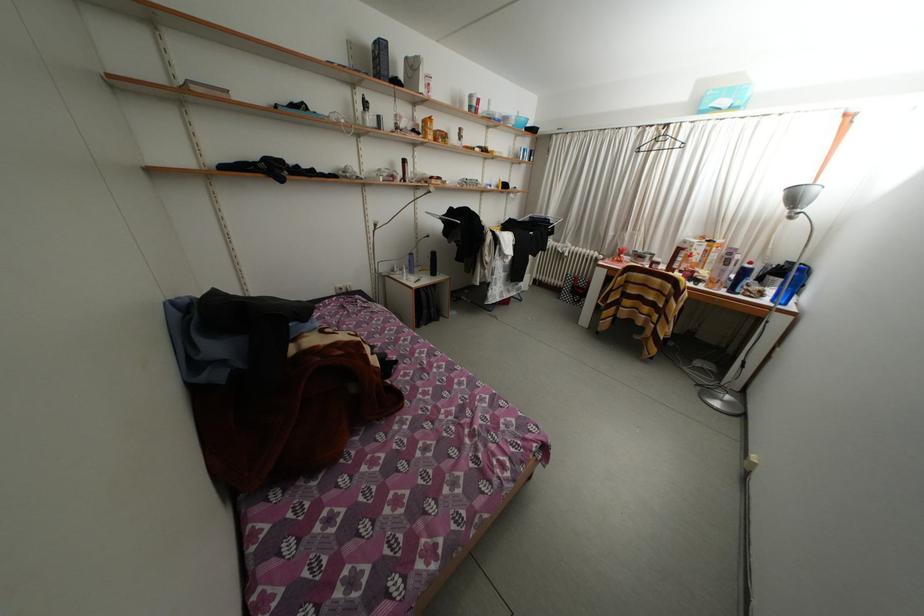
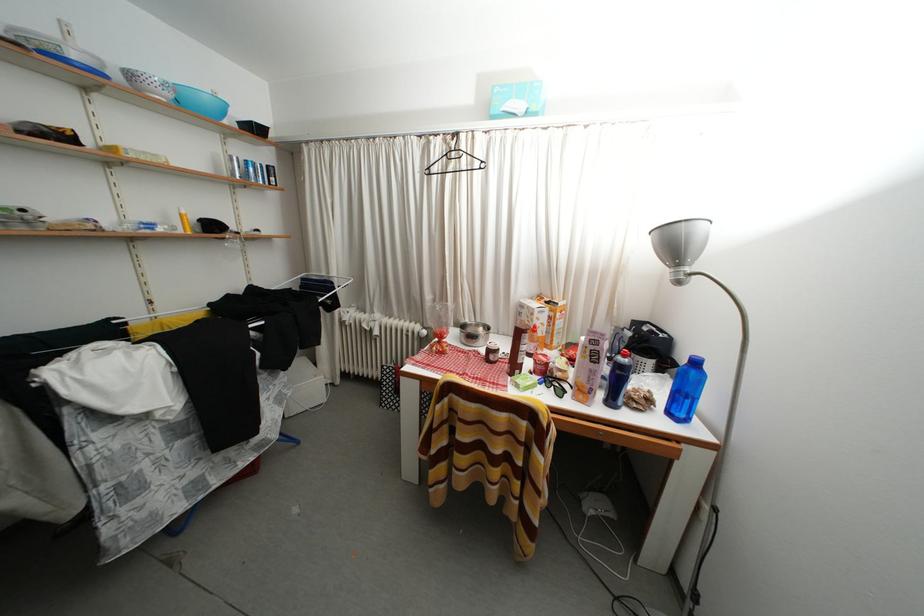
The point at (505, 122) is marked in the first image. Where is the corresponding point in the second image?

(81, 61)